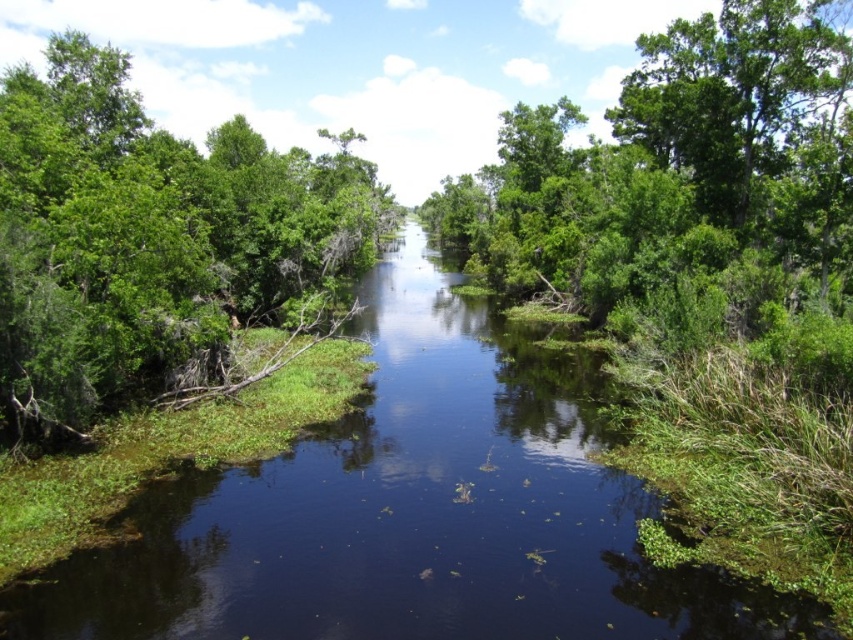
You are a kayaker navigating the green leafy stream at center and want to reach the green leafy tree at upper right. Which direction should you paddle to get closer to the tree?

You should paddle to the right because the green leafy stream at center is to the left of the green leafy tree at upper right, so moving right along the stream will bring you closer to the tree.

You are a bird flying over the serene waterway. You see the green leafy tree at left and the green leafy tree at upper right. Which tree is closer to the water surface below you?

The green leafy tree at left is positioned over the green leafy tree at upper right, meaning it is closer to the water surface below you.

You are a small boat navigating the green leafy stream at center. You notice the green leafy tree at left overhead. Can you tell me which direction the tree is relative to your boat?

The green leafy tree at left is above the green leafy stream at center, so the tree is directly overhead relative to the boat on the stream.